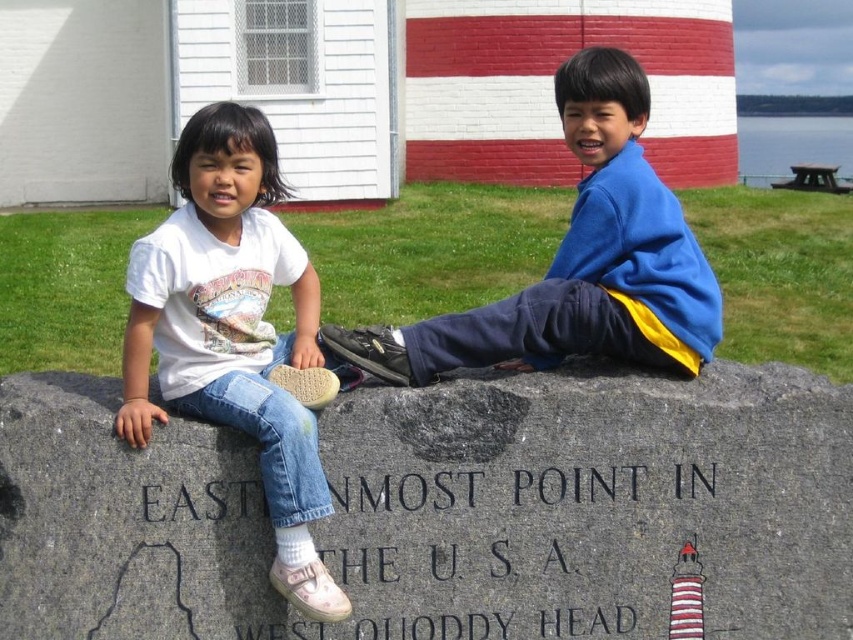
You are a photographer trying to capture the children on the stone marker. You need to ensure that the white cotton shirt at left is centered in your shot. Given its coordinates at point 0.517, 0.274, what adjustment should you make to the camera frame?

The white cotton shirt at left is already centered at coordinates (233,330), so no adjustment is needed.

You are a photographer trying to capture a photo of the gray granite stone at center and the blue fleece jacket at center. Which object should you focus on first if you want to ensure both are in focus?

The gray granite stone at center is closer to the viewer than the blue fleece jacket at center, so you should focus on the gray granite stone at center first to ensure both are in focus.